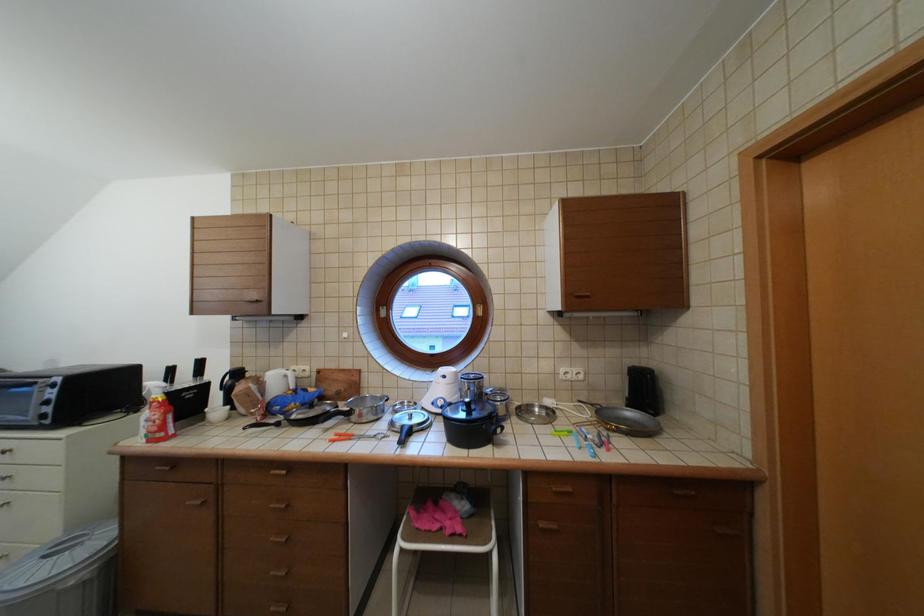
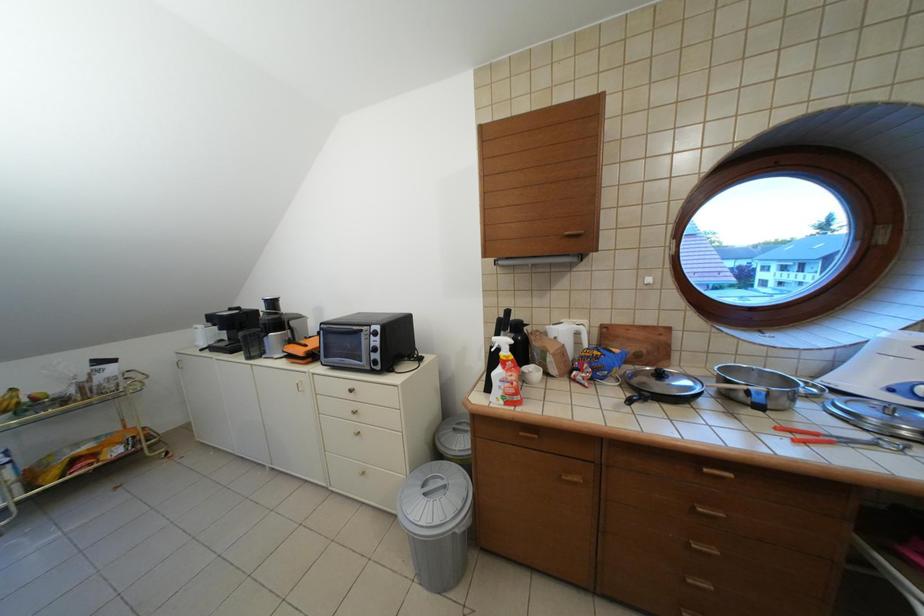
Question: In a continuous first-person perspective shot, in which direction is the camera moving?

Choices:
 (A) Left
 (B) Right
 (C) Forward
 (D) Backward

Answer: (A)